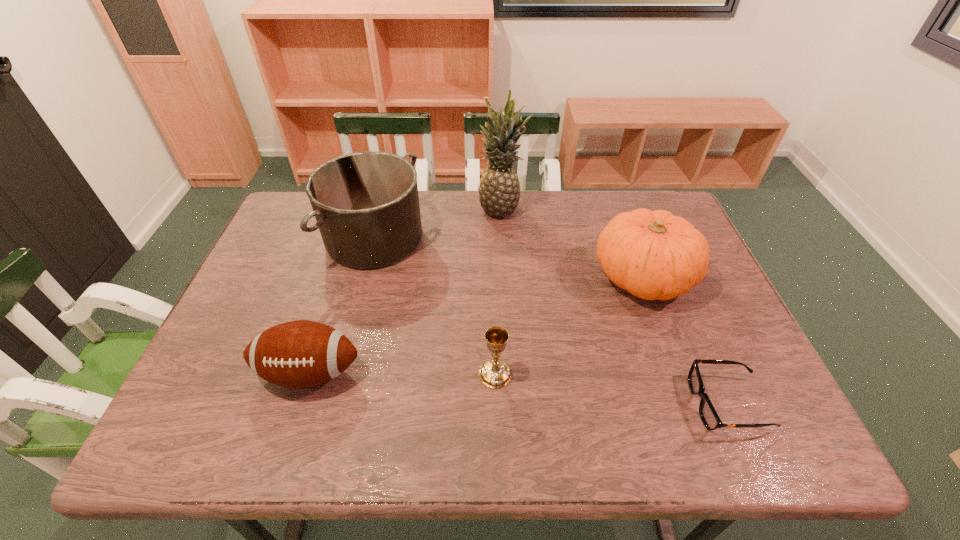
Identify the location of free space located on the right of the chalice. The height and width of the screenshot is (540, 960). (613, 374).

At what (x,y) coordinates should I click in order to perform the action: click on free space located on the front-facing side of the sunglasses. Please return your answer as a coordinate pair (x, y). Looking at the image, I should click on (516, 404).

The image size is (960, 540). In order to click on blank area located 0.240m on the front-facing side of the sunglasses in this screenshot , I will do `click(581, 404)`.

Where is `free region located 0.110m on the front-facing side of the sunglasses`? free region located 0.110m on the front-facing side of the sunglasses is located at coordinates (641, 404).

The width and height of the screenshot is (960, 540). In order to click on pineapple present at the far edge in this screenshot , I will do `click(499, 189)`.

This screenshot has height=540, width=960. What are the coordinates of `pan present at the far edge` in the screenshot? It's located at (366, 204).

Locate an element on the screen. object present at the near edge is located at coordinates (711, 420).

At what (x,y) coordinates should I click in order to perform the action: click on object that is at the left edge. Please return your answer as a coordinate pair (x, y). Looking at the image, I should click on (298, 354).

Find the location of `pumpkin at the right edge`. pumpkin at the right edge is located at coordinates (654, 255).

The height and width of the screenshot is (540, 960). Identify the location of sunglasses located in the right edge section of the desktop. (711, 420).